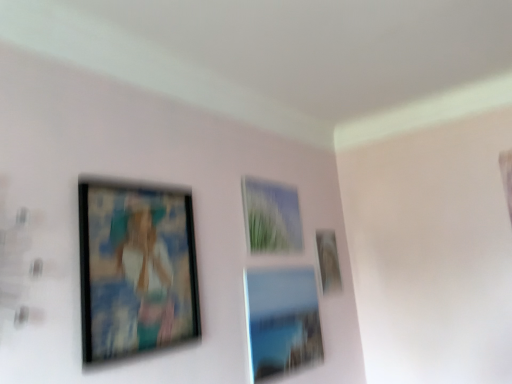
Question: In which direction should I rotate to look at matte glass picture frame at center, the third picture frame when ordered from right to left?

Choices:
 (A) left
 (B) right

Answer: (B)

Question: From a real-world perspective, is matte glass picture frame at center, the third picture frame when ordered from right to left, physically above matte black picture frame at left, placed as the 4th picture frame when sorted from right to left?

Choices:
 (A) yes
 (B) no

Answer: (A)

Question: Is matte glass picture frame at center, acting as the 2th picture frame starting from the left, at the right side of matte black picture frame at left, the first picture frame in the left-to-right sequence?

Choices:
 (A) yes
 (B) no

Answer: (A)

Question: From a real-world perspective, is matte glass picture frame at center, the third picture frame when ordered from right to left, positioned under matte black picture frame at left, placed as the 4th picture frame when sorted from right to left, based on gravity?

Choices:
 (A) yes
 (B) no

Answer: (B)

Question: Is matte glass picture frame at center, the third picture frame when ordered from right to left, shorter than matte black picture frame at left, placed as the 4th picture frame when sorted from right to left?

Choices:
 (A) yes
 (B) no

Answer: (A)

Question: Can you confirm if matte glass picture frame at center, acting as the 2th picture frame starting from the left, is smaller than matte black picture frame at left, placed as the 4th picture frame when sorted from right to left?

Choices:
 (A) yes
 (B) no

Answer: (A)

Question: Are matte glass picture frame at center, the third picture frame when ordered from right to left, and matte black picture frame at left, placed as the 4th picture frame when sorted from right to left, far apart?

Choices:
 (A) yes
 (B) no

Answer: (B)

Question: From a real-world perspective, is matte glass picture frame at center, which ranks as the 2th picture frame in right-to-left order, beneath matte glass picture frame at center, acting as the 2th picture frame starting from the left?

Choices:
 (A) no
 (B) yes

Answer: (B)

Question: Are matte glass picture frame at center, which ranks as the 2th picture frame in right-to-left order, and matte glass picture frame at center, acting as the 2th picture frame starting from the left, far apart?

Choices:
 (A) yes
 (B) no

Answer: (B)

Question: From the image's perspective, is matte glass picture frame at center, which ranks as the 2th picture frame in right-to-left order, under matte glass picture frame at center, the third picture frame when ordered from right to left?

Choices:
 (A) yes
 (B) no

Answer: (A)

Question: Can you confirm if matte glass picture frame at center, the third picture frame viewed from the left, is thinner than matte glass picture frame at center, acting as the 2th picture frame starting from the left?

Choices:
 (A) yes
 (B) no

Answer: (B)

Question: From the image's perspective, does matte glass picture frame at center, which ranks as the 2th picture frame in right-to-left order, appear higher than matte glass picture frame at center, acting as the 2th picture frame starting from the left?

Choices:
 (A) yes
 (B) no

Answer: (B)

Question: Can you confirm if matte glass picture frame at center, which ranks as the 2th picture frame in right-to-left order, is bigger than matte glass picture frame at center, acting as the 2th picture frame starting from the left?

Choices:
 (A) no
 (B) yes

Answer: (B)

Question: Considering the relative positions of matte black picture frame at left, the first picture frame in the left-to-right sequence, and matte glass picture frame at center, the third picture frame when ordered from right to left, in the image provided, is matte black picture frame at left, the first picture frame in the left-to-right sequence, to the left of matte glass picture frame at center, the third picture frame when ordered from right to left, from the viewer's perspective?

Choices:
 (A) yes
 (B) no

Answer: (A)